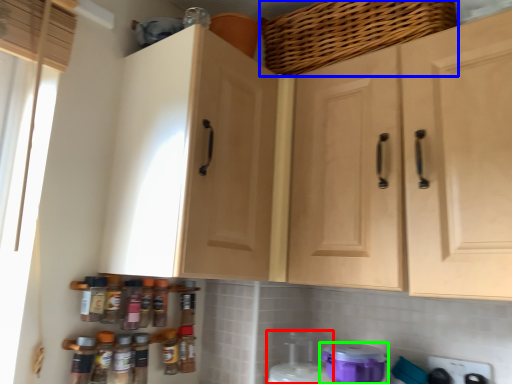
Question: Which object is positioned closest to appliance (highlighted by a red box)? Select from basket (highlighted by a blue box) and appliance (highlighted by a green box).

Choices:
 (A) basket
 (B) appliance

Answer: (B)